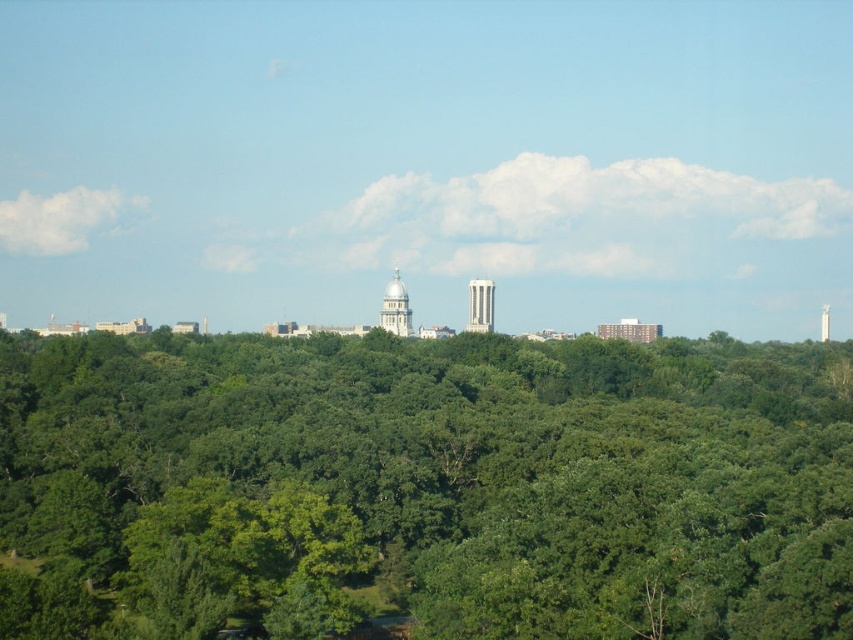
You are a city planner analyzing the layout of this area. You need to place a new emergency access point that must be exactly at the coordinates of the white glossy water tower at center. What are the coordinates where you should place it?

The coordinates for the white glossy water tower at center are at point (395, 307), so you should place the emergency access point there.